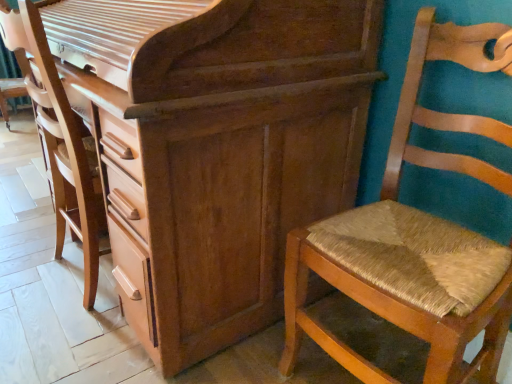
Question: Can you confirm if wooden chest of drawers at center is taller than wooden textured swivel chair at center?

Choices:
 (A) no
 (B) yes

Answer: (B)

Question: Is wooden chest of drawers at center closer to camera compared to wooden textured swivel chair at center?

Choices:
 (A) yes
 (B) no

Answer: (A)

Question: From a real-world perspective, is wooden chest of drawers at center physically above wooden textured swivel chair at center?

Choices:
 (A) yes
 (B) no

Answer: (A)

Question: Is wooden chest of drawers at center not inside wooden textured swivel chair at center?

Choices:
 (A) yes
 (B) no

Answer: (A)

Question: Can you confirm if wooden chest of drawers at center is shorter than wooden textured swivel chair at center?

Choices:
 (A) yes
 (B) no

Answer: (B)

Question: From a real-world perspective, is wooden chest of drawers at center located beneath wooden textured swivel chair at center?

Choices:
 (A) yes
 (B) no

Answer: (B)

Question: Is woven straw chair at right a part of wooden chest of drawers at center?

Choices:
 (A) no
 (B) yes

Answer: (A)

Question: Is wooden chest of drawers at center oriented towards woven straw chair at right?

Choices:
 (A) yes
 (B) no

Answer: (B)

Question: From a real-world perspective, is wooden chest of drawers at center positioned over woven straw chair at right based on gravity?

Choices:
 (A) no
 (B) yes

Answer: (B)

Question: Does wooden chest of drawers at center have a greater height compared to woven straw chair at right?

Choices:
 (A) yes
 (B) no

Answer: (A)

Question: Is wooden chest of drawers at center not close to woven straw chair at right?

Choices:
 (A) yes
 (B) no

Answer: (B)

Question: Is wooden chest of drawers at center beside woven straw chair at right?

Choices:
 (A) no
 (B) yes

Answer: (A)

Question: Is woven straw chair at right positioned with its back to wooden textured swivel chair at center?

Choices:
 (A) no
 (B) yes

Answer: (A)